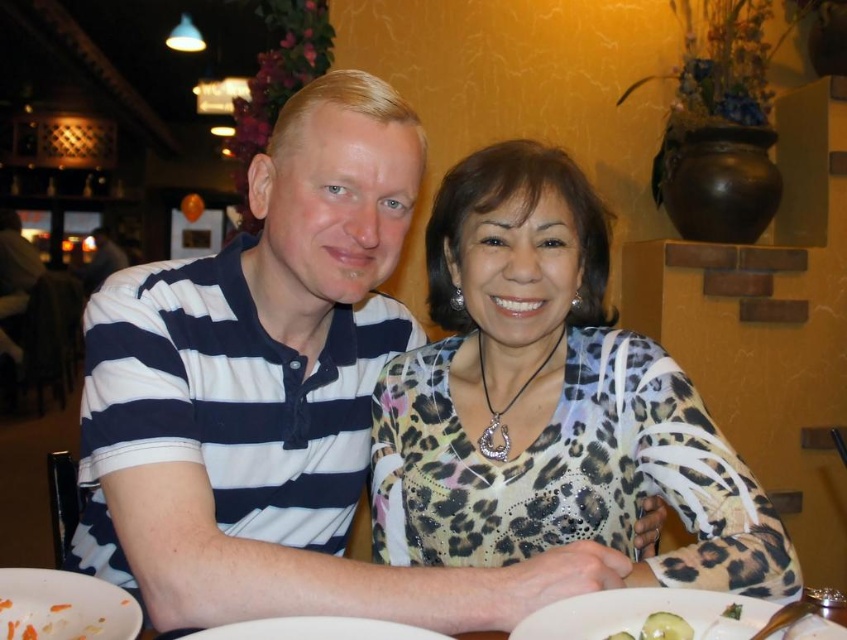
Question: Can you confirm if leopard print blouse at center is positioned to the right of carrot shredded at lower left?

Choices:
 (A) yes
 (B) no

Answer: (A)

Question: Which is farther from the leopard print blouse at center?

Choices:
 (A) carrot shredded at lower left
 (B) white matte plate at lower left

Answer: (A)

Question: Which point is farther to the camera?

Choices:
 (A) (507, 209)
 (B) (367, 632)
 (C) (25, 614)

Answer: (A)

Question: Can you confirm if white matte plate at lower left is wider than carrot shredded at lower left?

Choices:
 (A) yes
 (B) no

Answer: (A)

Question: Which is nearer to the leopard print blouse at center?

Choices:
 (A) carrot shredded at lower left
 (B) white matte plate at lower left
 (C) white ceramic plate at lower center
 (D) white glossy plate at lower center

Answer: (C)

Question: Does white ceramic plate at lower center have a greater width compared to white glossy plate at lower center?

Choices:
 (A) yes
 (B) no

Answer: (A)